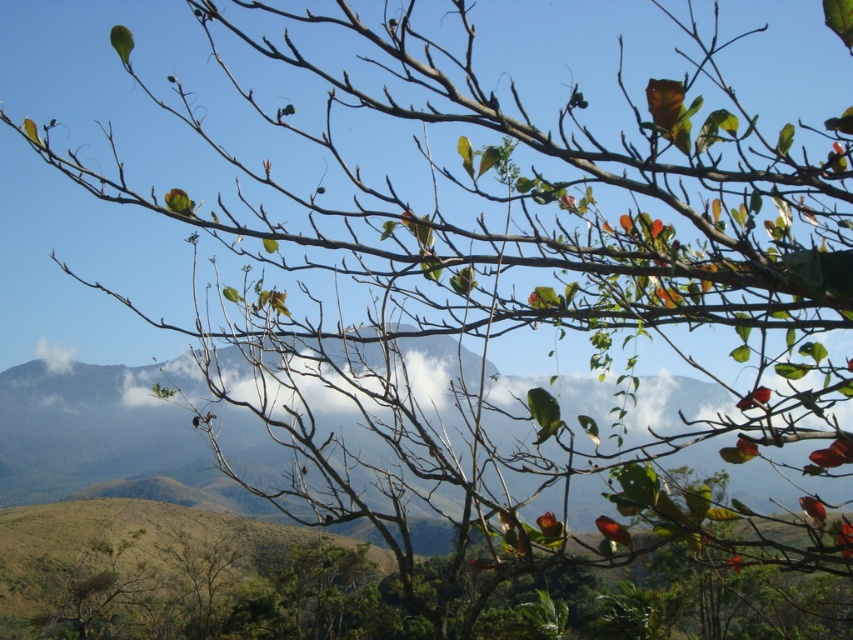
Question: Among these objects, which one is nearest to the camera?

Choices:
 (A) white fluffy cloud at center
 (B) green matte parrot at upper left

Answer: (A)

Question: Is white fluffy cloud at center positioned before green matte parrot at upper left?

Choices:
 (A) no
 (B) yes

Answer: (B)

Question: Which of the following is the farthest from the observer?

Choices:
 (A) green matte parrot at upper left
 (B) white fluffy cloud at center

Answer: (A)

Question: From the image, what is the correct spatial relationship of white fluffy cloud at center in relation to green matte parrot at upper left?

Choices:
 (A) right
 (B) left

Answer: (B)

Question: Is white fluffy cloud at center wider than green matte parrot at upper left?

Choices:
 (A) no
 (B) yes

Answer: (B)